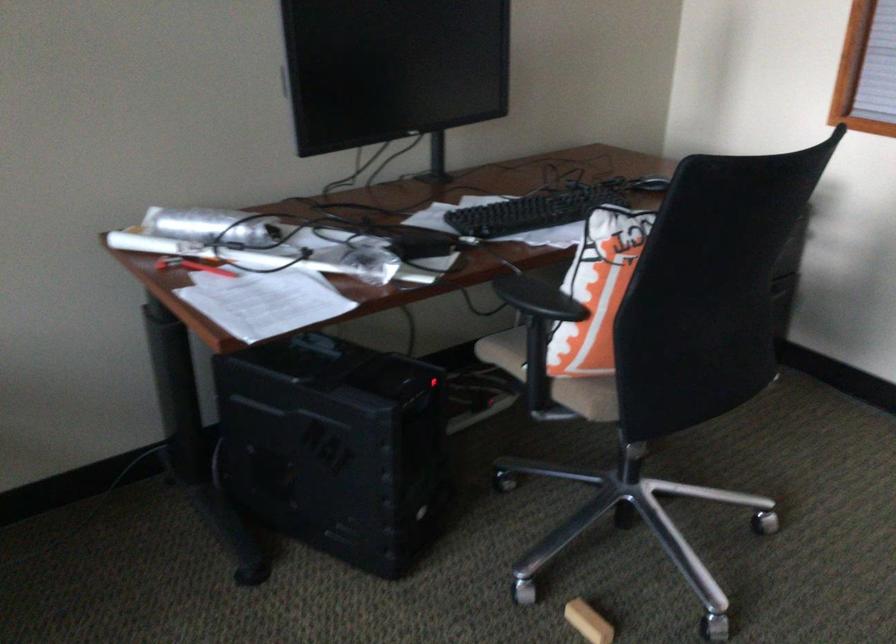
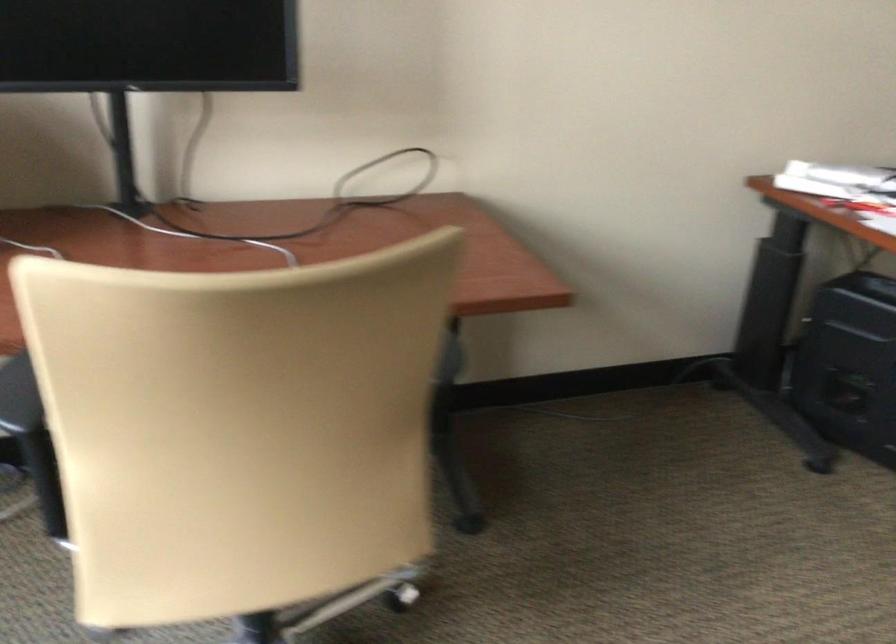
Which direction would the cameraman need to move to produce the second image?

The movement direction of the cameraman is left, backward.